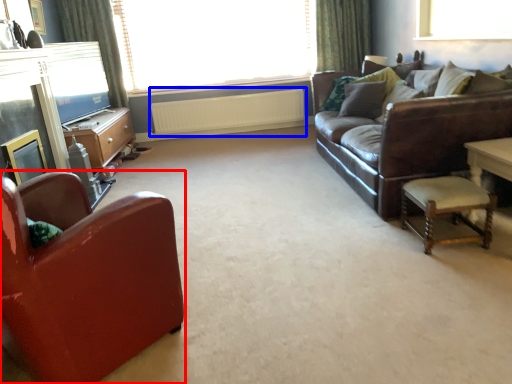
Question: Among these objects, which one is farthest to the camera, chair (highlighted by a red box) or radiator (highlighted by a blue box)?

Choices:
 (A) chair
 (B) radiator

Answer: (B)